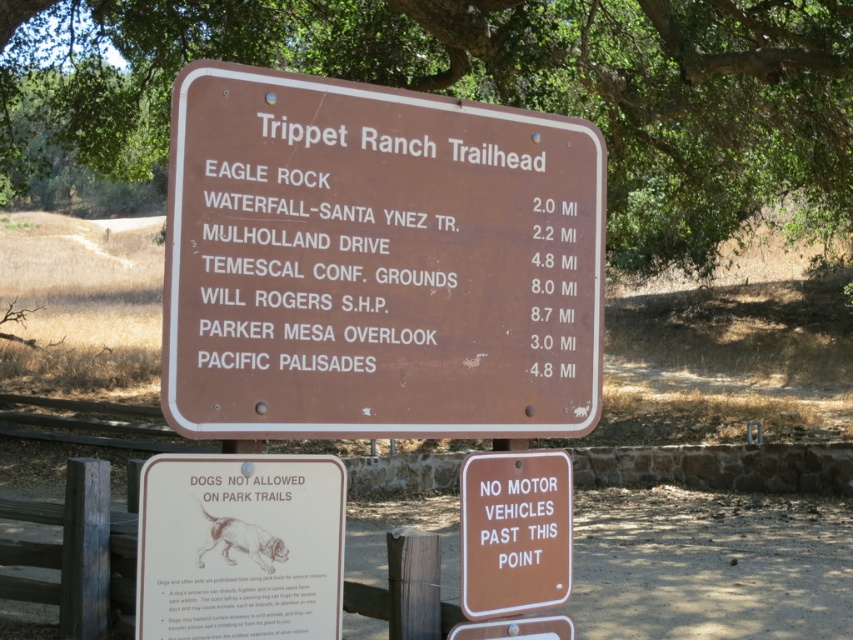
In the scene shown: Can you confirm if brown wooden sign at center is smaller than matte brown sign at center?

No, brown wooden sign at center is not smaller than matte brown sign at center.

Does point (438, 186) come farther from viewer compared to point (263, 456)?

That is True.

Locate an element on the screen. Image resolution: width=853 pixels, height=640 pixels. brown wooden sign at center is located at coordinates (376, 262).

Does brown wooden sign at center have a smaller size compared to green leafy tree at upper center?

Indeed, brown wooden sign at center has a smaller size compared to green leafy tree at upper center.

Does brown wooden sign at center have a larger size compared to green leafy tree at upper center?

Incorrect, brown wooden sign at center is not larger than green leafy tree at upper center.

You are a GUI agent. You are given a task and a screenshot of the screen. Output one action in this format:
    pyautogui.click(x=<x>, y=<y>)
    Task: Click on the brown wooden sign at center
    The height and width of the screenshot is (640, 853).
    Given the screenshot: What is the action you would take?
    pyautogui.click(x=376, y=262)

This screenshot has height=640, width=853. I want to click on brown wooden sign at center, so click(376, 262).

Can you confirm if green leafy tree at upper center is bigger than matte brown sign at center?

Indeed, green leafy tree at upper center has a larger size compared to matte brown sign at center.

In the scene shown: Does green leafy tree at upper center appear on the left side of matte brown sign at center?

No, green leafy tree at upper center is not to the left of matte brown sign at center.

Between point (611, 161) and point (181, 477), which one is positioned behind?

Point (611, 161)

Find the location of a particular element. The height and width of the screenshot is (640, 853). green leafy tree at upper center is located at coordinates (488, 90).